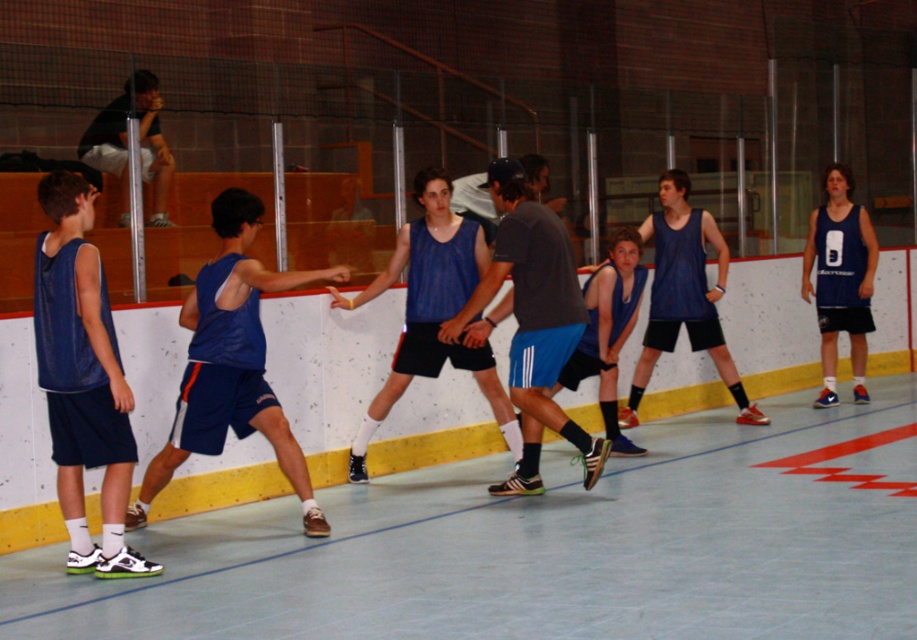
You are a photographer setting up a camera on the sidelines of the basketball court. You want to capture a shot that includes both the matte blue shorts at left and the matte blue tank top at center. Considering their sizes, which object should you zoom in on to ensure both fit in the frame without cropping?

Since the matte blue shorts at left are wider than the matte blue tank top at center, you should zoom in on the matte blue tank top at center to accommodate the larger width of the matte blue shorts at left in the frame.

You are a photographer positioned at the back of the court. You need to capture a photo of both the matte blue tank top at left and the matte blue tank top at center without cropping either. Which player should you ensure is closer to the camera to avoid them being too small in the photo?

To ensure both the matte blue tank top at left and the matte blue tank top at center are visible without cropping, the matte blue tank top at center should be closer to the camera since its width is greater than the one at left, making it naturally larger in the frame.